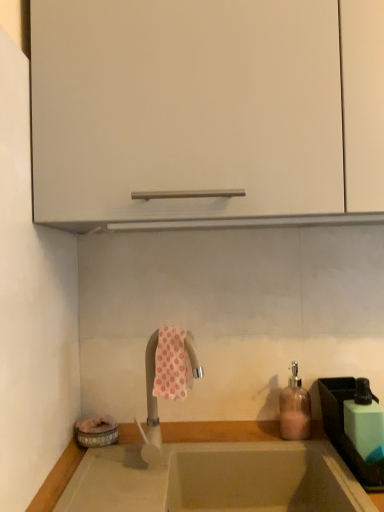
Question: From a real-world perspective, is white matte cabinet at upper center positioned over smooth beige countertop at lower center based on gravity?

Choices:
 (A) yes
 (B) no

Answer: (A)

Question: Is white matte cabinet at upper center beside smooth beige countertop at lower center?

Choices:
 (A) no
 (B) yes

Answer: (A)

Question: From the image's perspective, is white matte cabinet at upper center under smooth beige countertop at lower center?

Choices:
 (A) no
 (B) yes

Answer: (A)

Question: Is white matte cabinet at upper center positioned behind smooth beige countertop at lower center?

Choices:
 (A) no
 (B) yes

Answer: (B)

Question: Considering the relative sizes of white matte cabinet at upper center and smooth beige countertop at lower center in the image provided, is white matte cabinet at upper center wider than smooth beige countertop at lower center?

Choices:
 (A) no
 (B) yes

Answer: (B)

Question: From the image's perspective, is white matte cabinet at upper center located above smooth beige countertop at lower center?

Choices:
 (A) yes
 (B) no

Answer: (A)

Question: Is green plastic sink at lower right facing towards silver metallic tap at center?

Choices:
 (A) no
 (B) yes

Answer: (A)

Question: From a real-world perspective, is green plastic sink at lower right below silver metallic tap at center?

Choices:
 (A) yes
 (B) no

Answer: (A)

Question: Considering the relative sizes of green plastic sink at lower right and silver metallic tap at center in the image provided, is green plastic sink at lower right shorter than silver metallic tap at center?

Choices:
 (A) yes
 (B) no

Answer: (A)

Question: Is green plastic sink at lower right positioned with its back to silver metallic tap at center?

Choices:
 (A) yes
 (B) no

Answer: (B)

Question: Is green plastic sink at lower right taller than silver metallic tap at center?

Choices:
 (A) no
 (B) yes

Answer: (A)

Question: Is green plastic sink at lower right touching silver metallic tap at center?

Choices:
 (A) yes
 (B) no

Answer: (B)

Question: Would you say green plastic sink at lower right contains pink floral fabric at center?

Choices:
 (A) yes
 (B) no

Answer: (B)